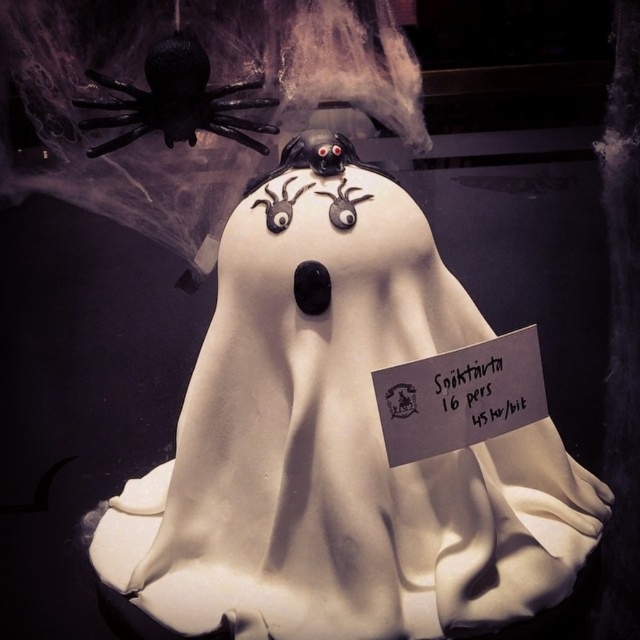
You are a decorator planning to place a black matte spider at upper left on the same table as the white fondant ghost at center. Considering their sizes, which one should you place first to ensure stability?

The white fondant ghost at center might be wider than black matte spider at upper left, so you should place the white fondant ghost at center first to ensure stability.

You are a baker who needs to place a white paper sign at center on the table. However, there is already a white fondant ghost at center on the table. Can you place the sign without moving the ghost?

The white fondant ghost at center is above the white paper sign at center, so the sign is already placed under the ghost. Therefore, you can place the sign without moving the ghost as it is already positioned there.

You are a guest at a Halloween party and see the black matte spider at upper left and the white paper sign at center on the cake. Which object is higher in height?

The black matte spider at upper left is taller than the white paper sign at center.